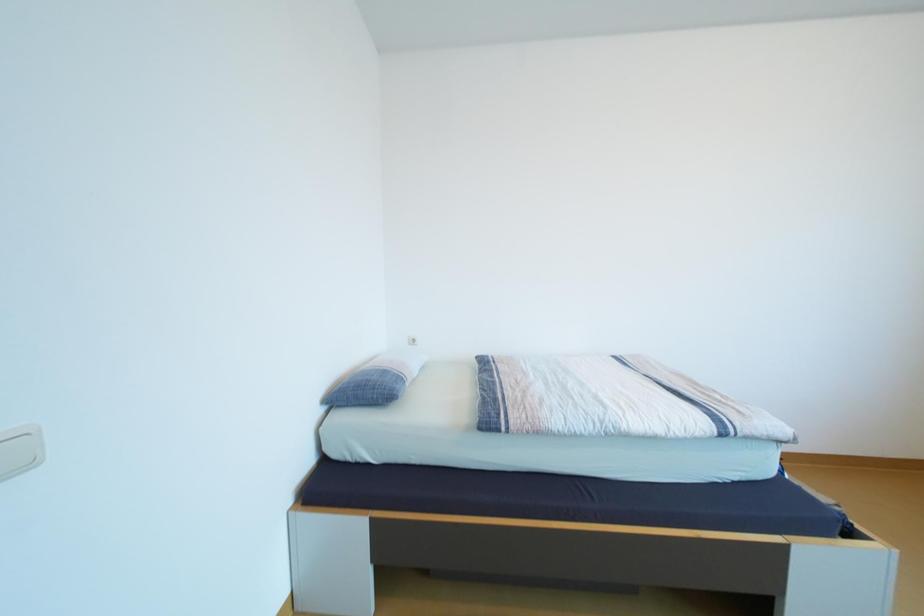
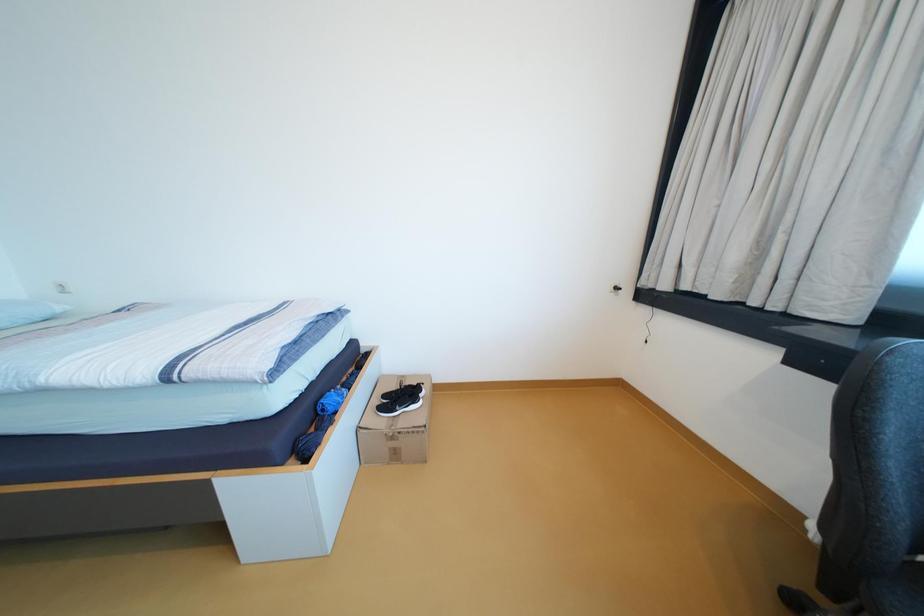
Question: In a continuous first-person perspective shot, in which direction is the camera moving?

Choices:
 (A) Left
 (B) Right
 (C) Forward
 (D) Backward

Answer: (B)